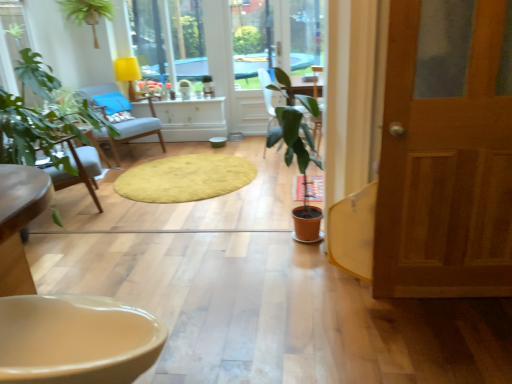
Question: Considering the relative sizes of yellow fabric lampshade at upper center and yellow soft rug at center in the image provided, is yellow fabric lampshade at upper center thinner than yellow soft rug at center?

Choices:
 (A) yes
 (B) no

Answer: (A)

Question: Can you confirm if yellow fabric lampshade at upper center is taller than yellow soft rug at center?

Choices:
 (A) no
 (B) yes

Answer: (B)

Question: Is yellow fabric lampshade at upper center facing away from yellow soft rug at center?

Choices:
 (A) yes
 (B) no

Answer: (B)

Question: Does yellow fabric lampshade at upper center have a larger size compared to yellow soft rug at center?

Choices:
 (A) no
 (B) yes

Answer: (B)

Question: Is yellow fabric lampshade at upper center placed right next to yellow soft rug at center?

Choices:
 (A) yes
 (B) no

Answer: (B)

Question: From the image's perspective, is yellow fabric lampshade at upper center located beneath yellow soft rug at center?

Choices:
 (A) no
 (B) yes

Answer: (A)

Question: Is wooden door at right completely or partially outside of green matte plant at upper left, the second houseplant from the right?

Choices:
 (A) no
 (B) yes

Answer: (B)

Question: Can you confirm if wooden door at right is wider than green matte plant at upper left, which ranks as the 2th houseplant in bottom-to-top order?

Choices:
 (A) yes
 (B) no

Answer: (B)

Question: Can you confirm if wooden door at right is thinner than green matte plant at upper left, which appears as the first houseplant when viewed from the back?

Choices:
 (A) no
 (B) yes

Answer: (B)

Question: Is the surface of wooden door at right in direct contact with green matte plant at upper left, which ranks as the 2th houseplant in bottom-to-top order?

Choices:
 (A) no
 (B) yes

Answer: (A)

Question: Does wooden door at right have a smaller size compared to green matte plant at upper left, the second houseplant from the right?

Choices:
 (A) no
 (B) yes

Answer: (B)

Question: From the image's perspective, is wooden door at right over green matte plant at upper left, which ranks as the 2th houseplant in bottom-to-top order?

Choices:
 (A) no
 (B) yes

Answer: (A)

Question: Does yellow soft rug at center have a greater width compared to light blue fabric chair at center?

Choices:
 (A) no
 (B) yes

Answer: (B)